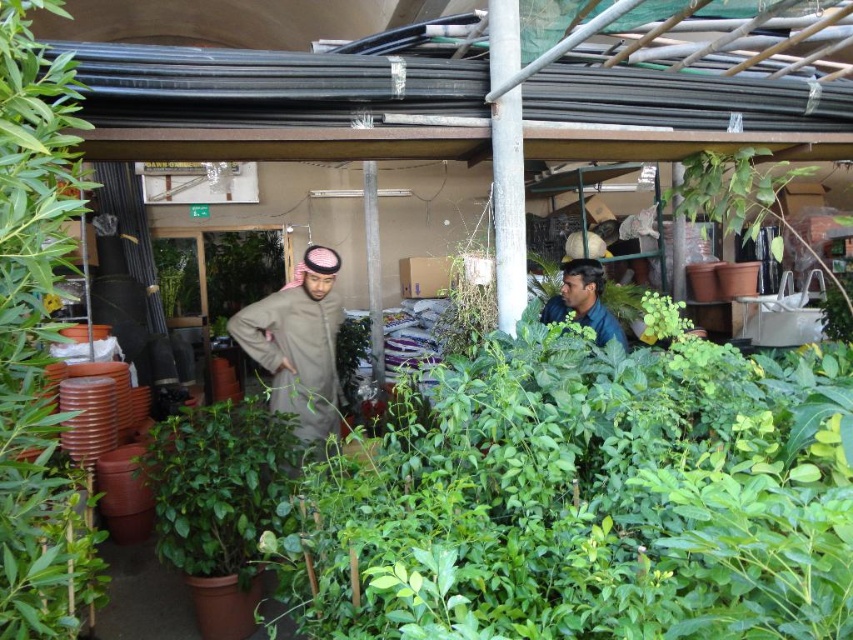
Does point (320, 355) come behind point (593, 316)?

Yes, it is behind point (593, 316).

The height and width of the screenshot is (640, 853). Find the location of `light brown fabric trench coat at center`. light brown fabric trench coat at center is located at coordinates (x=296, y=349).